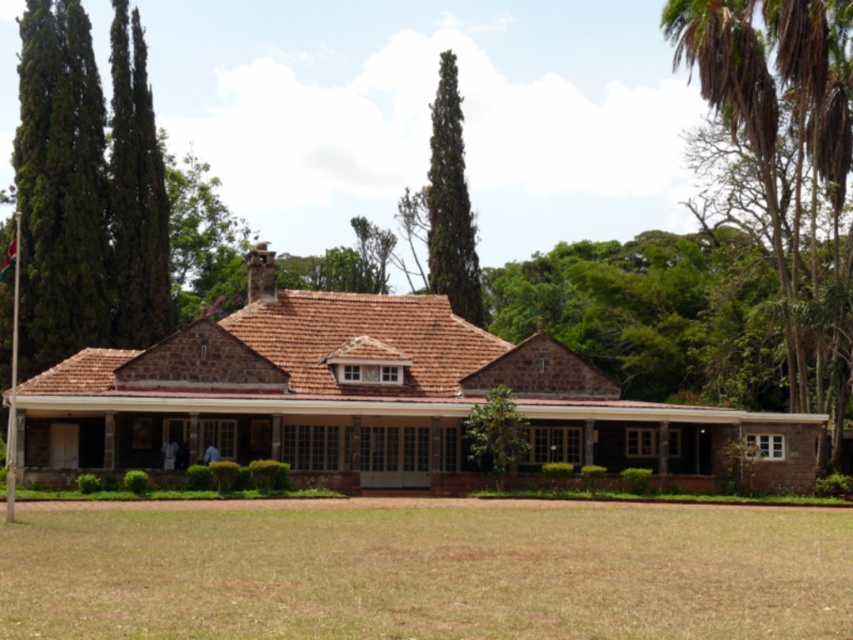
Question: Estimate the real-world distances between objects in this image. Which object is farther from the green textured cypress at upper center?

Choices:
 (A) brown stone porch at center
 (B) metallic flag pole at left
 (C) brown grass at lower center

Answer: (C)

Question: Is brown stone porch at center further to the viewer compared to green textured cypress at upper center?

Choices:
 (A) no
 (B) yes

Answer: (A)

Question: Is brown grass at lower center wider than metallic flag pole at left?

Choices:
 (A) no
 (B) yes

Answer: (B)

Question: Which object appears farthest from the camera in this image?

Choices:
 (A) green textured cypress at upper center
 (B) brown grass at lower center
 (C) metallic flag pole at left
 (D) brown stone porch at center

Answer: (A)

Question: Estimate the real-world distances between objects in this image. Which object is closer to the brown grass at lower center?

Choices:
 (A) green textured cypress at upper center
 (B) metallic flag pole at left

Answer: (B)

Question: Is brown stone porch at center in front of green textured cypress at upper center?

Choices:
 (A) no
 (B) yes

Answer: (B)